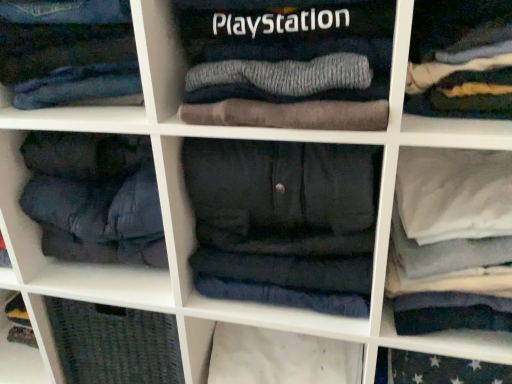
Where is `dark gray fleece pants at center, which is counted as the 2th clothing, starting from the top`? This screenshot has height=384, width=512. dark gray fleece pants at center, which is counted as the 2th clothing, starting from the top is located at coordinates (284, 222).

The height and width of the screenshot is (384, 512). What do you see at coordinates (284, 222) in the screenshot?
I see `dark gray fleece pants at center, which ranks as the first clothing in bottom-to-top order` at bounding box center [284, 222].

The height and width of the screenshot is (384, 512). What do you see at coordinates (68, 53) in the screenshot? I see `denim jeans at upper center, positioned as the first clothing in left-to-right order` at bounding box center [68, 53].

Measure the distance between denim jeans at upper center, the first clothing viewed from the top, and camera.

25.71 inches.

The image size is (512, 384). I want to click on denim jeans at upper center, positioned as the first clothing in left-to-right order, so click(x=68, y=53).

You are a GUI agent. You are given a task and a screenshot of the screen. Output one action in this format:
    pyautogui.click(x=<x>, y=<y>)
    Task: Click on the dark gray fleece pants at center, which is counted as the second clothing, starting from the left
    The height and width of the screenshot is (384, 512).
    Given the screenshot: What is the action you would take?
    pyautogui.click(x=284, y=222)

Visually, is dark gray fleece pants at center, which is counted as the second clothing, starting from the left, positioned to the left or to the right of denim jeans at upper center, the first clothing viewed from the top?

dark gray fleece pants at center, which is counted as the second clothing, starting from the left, is to the right of denim jeans at upper center, the first clothing viewed from the top.

Which object is closer to the camera, dark gray fleece pants at center, which is counted as the second clothing, starting from the left, or denim jeans at upper center, marked as the second clothing in a bottom-to-top arrangement?

denim jeans at upper center, marked as the second clothing in a bottom-to-top arrangement.

Considering the points (199, 241) and (14, 55), which point is behind, point (199, 241) or point (14, 55)?

The point (199, 241) is farther from the camera.

From the image's perspective, which is below, dark gray fleece pants at center, which is counted as the 2th clothing, starting from the top, or denim jeans at upper center, marked as the second clothing in a bottom-to-top arrangement?

dark gray fleece pants at center, which is counted as the 2th clothing, starting from the top, appears lower in the image.

From a real-world perspective, is dark gray fleece pants at center, which ranks as the first clothing in bottom-to-top order, positioned over denim jeans at upper center, the first clothing viewed from the top, based on gravity?

No, from a real-world perspective, dark gray fleece pants at center, which ranks as the first clothing in bottom-to-top order, is not over denim jeans at upper center, the first clothing viewed from the top

Considering the relative sizes of dark gray fleece pants at center, which is counted as the 2th clothing, starting from the top, and denim jeans at upper center, the first clothing viewed from the top, in the image provided, is dark gray fleece pants at center, which is counted as the 2th clothing, starting from the top, thinner than denim jeans at upper center, the first clothing viewed from the top,?

Incorrect, the width of dark gray fleece pants at center, which is counted as the 2th clothing, starting from the top, is not less than that of denim jeans at upper center, the first clothing viewed from the top.

In terms of height, does dark gray fleece pants at center, which is counted as the second clothing, starting from the left, look taller or shorter compared to denim jeans at upper center, marked as the second clothing in a bottom-to-top arrangement?

In the image, dark gray fleece pants at center, which is counted as the second clothing, starting from the left, appears to be taller than denim jeans at upper center, marked as the second clothing in a bottom-to-top arrangement.

Based on the photo, considering the sizes of objects dark gray fleece pants at center, arranged as the 1th clothing when viewed from the right, and denim jeans at upper center, the first clothing viewed from the top, in the image provided, who is bigger, dark gray fleece pants at center, arranged as the 1th clothing when viewed from the right, or denim jeans at upper center, the first clothing viewed from the top,?

With larger size is dark gray fleece pants at center, arranged as the 1th clothing when viewed from the right.

Would you say denim jeans at upper center, positioned as the first clothing in left-to-right order, is part of dark gray fleece pants at center, which is counted as the second clothing, starting from the left,'s contents?

No, denim jeans at upper center, positioned as the first clothing in left-to-right order, is located outside of dark gray fleece pants at center, which is counted as the second clothing, starting from the left.

Does dark gray fleece pants at center, arranged as the 1th clothing when viewed from the right, touch denim jeans at upper center, which ranks as the second clothing in right-to-left order?

No, dark gray fleece pants at center, arranged as the 1th clothing when viewed from the right, is not beside denim jeans at upper center, which ranks as the second clothing in right-to-left order.

Is dark gray fleece pants at center, arranged as the 1th clothing when viewed from the right, turned away from denim jeans at upper center, marked as the second clothing in a bottom-to-top arrangement?

dark gray fleece pants at center, arranged as the 1th clothing when viewed from the right, is not turned away from denim jeans at upper center, marked as the second clothing in a bottom-to-top arrangement.

Find the location of `clothing above the dark gray fleece pants at center, arranged as the 1th clothing when viewed from the right (from the image's perspective)`. clothing above the dark gray fleece pants at center, arranged as the 1th clothing when viewed from the right (from the image's perspective) is located at coordinates pos(68,53).

Which object is positioned more to the right, denim jeans at upper center, positioned as the first clothing in left-to-right order, or dark gray fleece pants at center, which is counted as the 2th clothing, starting from the top?

From the viewer's perspective, dark gray fleece pants at center, which is counted as the 2th clothing, starting from the top, appears more on the right side.

Does denim jeans at upper center, the first clothing viewed from the top, lie behind dark gray fleece pants at center, which is counted as the second clothing, starting from the left?

No, denim jeans at upper center, the first clothing viewed from the top, is in front of dark gray fleece pants at center, which is counted as the second clothing, starting from the left.

Between point (99, 2) and point (240, 181), which one is positioned behind?

Positioned behind is point (240, 181).

From the image's perspective, is denim jeans at upper center, positioned as the first clothing in left-to-right order, above or below dark gray fleece pants at center, which is counted as the 2th clothing, starting from the top?

Based on their image positions, denim jeans at upper center, positioned as the first clothing in left-to-right order, is located above dark gray fleece pants at center, which is counted as the 2th clothing, starting from the top.

From a real-world perspective, is denim jeans at upper center, the first clothing viewed from the top, positioned above or below dark gray fleece pants at center, arranged as the 1th clothing when viewed from the right?

denim jeans at upper center, the first clothing viewed from the top, is above dark gray fleece pants at center, arranged as the 1th clothing when viewed from the right.

Considering the sizes of objects denim jeans at upper center, positioned as the first clothing in left-to-right order, and dark gray fleece pants at center, arranged as the 1th clothing when viewed from the right, in the image provided, who is wider, denim jeans at upper center, positioned as the first clothing in left-to-right order, or dark gray fleece pants at center, arranged as the 1th clothing when viewed from the right,?

With larger width is dark gray fleece pants at center, arranged as the 1th clothing when viewed from the right.

Which of these two, denim jeans at upper center, positioned as the first clothing in left-to-right order, or dark gray fleece pants at center, arranged as the 1th clothing when viewed from the right, stands shorter?

denim jeans at upper center, positioned as the first clothing in left-to-right order, is shorter.

Considering the sizes of objects denim jeans at upper center, the first clothing viewed from the top, and dark gray fleece pants at center, which is counted as the second clothing, starting from the left, in the image provided, who is bigger, denim jeans at upper center, the first clothing viewed from the top, or dark gray fleece pants at center, which is counted as the second clothing, starting from the left,?

dark gray fleece pants at center, which is counted as the second clothing, starting from the left.

Is dark gray fleece pants at center, which is counted as the second clothing, starting from the left, inside denim jeans at upper center, marked as the second clothing in a bottom-to-top arrangement?

No, dark gray fleece pants at center, which is counted as the second clothing, starting from the left, is not inside denim jeans at upper center, marked as the second clothing in a bottom-to-top arrangement.

Consider the image. Is denim jeans at upper center, marked as the second clothing in a bottom-to-top arrangement, with dark gray fleece pants at center, which is counted as the 2th clothing, starting from the top?

There is a gap between denim jeans at upper center, marked as the second clothing in a bottom-to-top arrangement, and dark gray fleece pants at center, which is counted as the 2th clothing, starting from the top.

Is denim jeans at upper center, which ranks as the second clothing in right-to-left order, looking in the opposite direction of dark gray fleece pants at center, which is counted as the second clothing, starting from the left?

That's not correct — denim jeans at upper center, which ranks as the second clothing in right-to-left order, is not looking away from dark gray fleece pants at center, which is counted as the second clothing, starting from the left.

Identify the location of clothing in front of the dark gray fleece pants at center, arranged as the 1th clothing when viewed from the right. (68, 53).

At what (x,y) coordinates should I click in order to perform the action: click on clothing above the dark gray fleece pants at center, which ranks as the first clothing in bottom-to-top order (from the image's perspective). Please return your answer as a coordinate pair (x, y). The image size is (512, 384). Looking at the image, I should click on (68, 53).

You are a GUI agent. You are given a task and a screenshot of the screen. Output one action in this format:
    pyautogui.click(x=<x>, y=<y>)
    Task: Click on the clothing that is above the dark gray fleece pants at center, which is counted as the 2th clothing, starting from the top (from a real-world perspective)
    
    Given the screenshot: What is the action you would take?
    pyautogui.click(x=68, y=53)